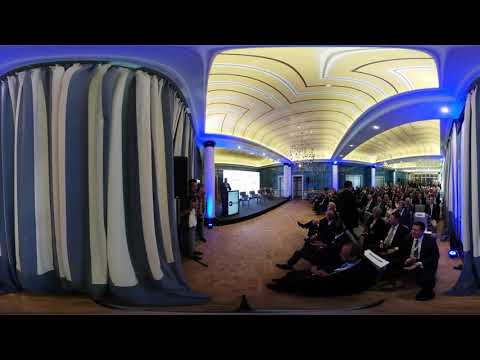
Identify the location of pillars. This screenshot has height=360, width=480. (207, 191), (285, 180), (333, 174), (372, 176), (395, 176).